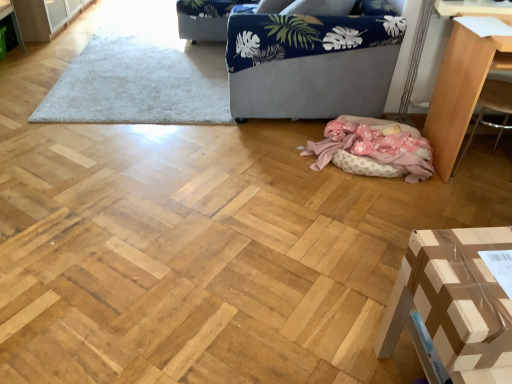
Question: Is pink polka dot fabric at lower center thinner than light brown wood table at right, which appears as the first furniture when viewed from the right?

Choices:
 (A) yes
 (B) no

Answer: (B)

Question: Does pink polka dot fabric at lower center have a smaller size compared to light brown wood table at right, which appears as the first furniture when viewed from the right?

Choices:
 (A) no
 (B) yes

Answer: (B)

Question: Can you confirm if pink polka dot fabric at lower center is shorter than light brown wood table at right, positioned as the second furniture in bottom-to-top order?

Choices:
 (A) yes
 (B) no

Answer: (A)

Question: From the image's perspective, does pink polka dot fabric at lower center appear higher than light brown wood table at right, the first furniture viewed from the top?

Choices:
 (A) yes
 (B) no

Answer: (B)

Question: Is pink polka dot fabric at lower center to the right of light brown wood table at right, the first furniture viewed from the top, from the viewer's perspective?

Choices:
 (A) yes
 (B) no

Answer: (B)

Question: Is pink polka dot fabric at lower center outside light brown wood table at right, marked as the second furniture in a front-to-back arrangement?

Choices:
 (A) yes
 (B) no

Answer: (A)

Question: From a real-world perspective, is white shaggy rug at upper center on top of brown cardboard box at lower right, the first furniture from the left?

Choices:
 (A) yes
 (B) no

Answer: (B)

Question: Is white shaggy rug at upper center not within brown cardboard box at lower right, the first furniture from the front?

Choices:
 (A) no
 (B) yes

Answer: (B)

Question: Is white shaggy rug at upper center facing away from brown cardboard box at lower right, the first furniture from the front?

Choices:
 (A) no
 (B) yes

Answer: (A)

Question: Is white shaggy rug at upper center next to brown cardboard box at lower right, marked as the 2th furniture in a back-to-front arrangement, and touching it?

Choices:
 (A) no
 (B) yes

Answer: (A)

Question: Is brown cardboard box at lower right, the first furniture from the left, inside white shaggy rug at upper center?

Choices:
 (A) no
 (B) yes

Answer: (A)

Question: Is white shaggy rug at upper center to the right of brown cardboard box at lower right, the first furniture from the front, from the viewer's perspective?

Choices:
 (A) yes
 (B) no

Answer: (B)

Question: Is pink polka dot fabric at lower center outside white shaggy rug at upper center?

Choices:
 (A) no
 (B) yes

Answer: (B)